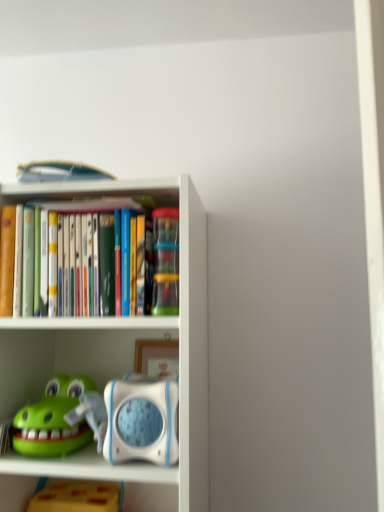
Question: Are green rubber toy at lower left, acting as the second toy starting from the top, and yellow matte block at lower left, the 1th toy when ordered from bottom to top, far apart?

Choices:
 (A) yes
 (B) no

Answer: (B)

Question: Can you confirm if green rubber toy at lower left, acting as the second toy starting from the top, is shorter than yellow matte block at lower left, the 1th toy when ordered from bottom to top?

Choices:
 (A) yes
 (B) no

Answer: (A)

Question: From a real-world perspective, is green rubber toy at lower left, which is counted as the second toy, starting from the bottom, over yellow matte block at lower left, the 1th toy when ordered from bottom to top?

Choices:
 (A) no
 (B) yes

Answer: (B)

Question: Is the position of green rubber toy at lower left, which is counted as the second toy, starting from the bottom, more distant than that of yellow matte block at lower left, which is counted as the third toy, starting from the top?

Choices:
 (A) yes
 (B) no

Answer: (B)

Question: From the image's perspective, is green rubber toy at lower left, acting as the second toy starting from the top, under yellow matte block at lower left, the 1th toy when ordered from bottom to top?

Choices:
 (A) yes
 (B) no

Answer: (B)

Question: From the image's perspective, is green rubber toy at lower left, which is counted as the second toy, starting from the bottom, over yellow matte block at lower left, the 1th toy when ordered from bottom to top?

Choices:
 (A) no
 (B) yes

Answer: (B)

Question: Can you confirm if yellow matte block at lower left, which is counted as the third toy, starting from the top, is taller than green rubber toy at lower left, which is counted as the second toy, starting from the bottom?

Choices:
 (A) no
 (B) yes

Answer: (B)

Question: Is yellow matte block at lower left, which is counted as the third toy, starting from the top, oriented towards green rubber toy at lower left, acting as the second toy starting from the top?

Choices:
 (A) no
 (B) yes

Answer: (A)

Question: Does yellow matte block at lower left, which is counted as the third toy, starting from the top, come behind green rubber toy at lower left, which is counted as the second toy, starting from the bottom?

Choices:
 (A) yes
 (B) no

Answer: (A)

Question: Is yellow matte block at lower left, the 1th toy when ordered from bottom to top, oriented away from green rubber toy at lower left, which is counted as the second toy, starting from the bottom?

Choices:
 (A) no
 (B) yes

Answer: (A)

Question: Is yellow matte block at lower left, which is counted as the third toy, starting from the top, to the right of green rubber toy at lower left, acting as the second toy starting from the top, from the viewer's perspective?

Choices:
 (A) no
 (B) yes

Answer: (B)

Question: From the image's perspective, would you say translucent plastic containers at center, positioned as the 3th toy in bottom-to-top order, is shown under green rubber toy at lower left, acting as the second toy starting from the top?

Choices:
 (A) yes
 (B) no

Answer: (B)